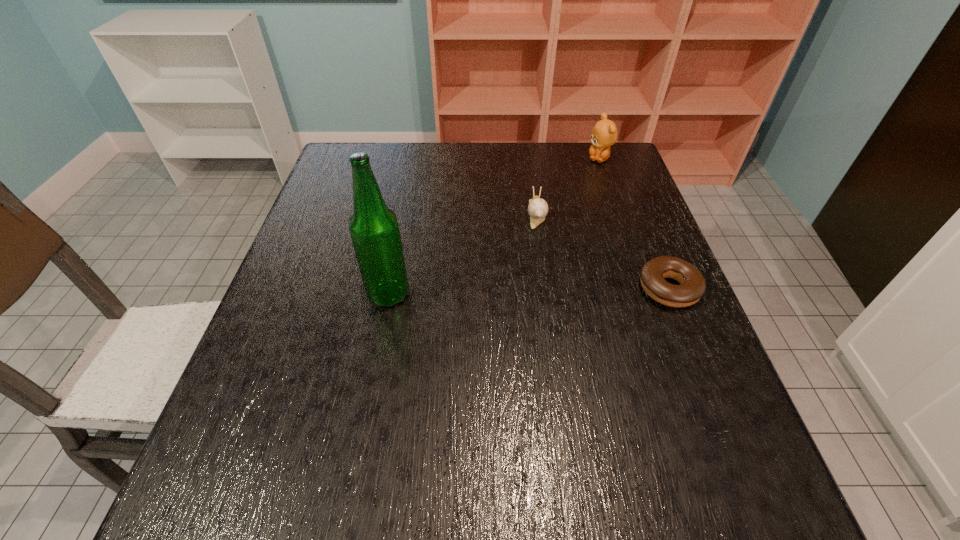
Where is `vacant space positioned 0.330m on the left of the doughnut`? The height and width of the screenshot is (540, 960). vacant space positioned 0.330m on the left of the doughnut is located at coordinates (492, 289).

Identify the location of free space located 0.150m on the shell of the escargot. (541, 271).

The image size is (960, 540). Find the location of `vacant point located 0.400m on the shell of the escargot`. vacant point located 0.400m on the shell of the escargot is located at coordinates (549, 361).

This screenshot has height=540, width=960. In order to click on vacant space situated on the shell of the escargot in this screenshot , I will do `click(541, 271)`.

Find the location of a particular element. vacant space located 0.140m on the face of the teddy bear is located at coordinates (577, 188).

This screenshot has height=540, width=960. In order to click on free region located on the face of the teddy bear in this screenshot , I will do `click(587, 177)`.

Find the location of a particular element. free space located on the face of the teddy bear is located at coordinates (559, 212).

I want to click on object that is at the far edge, so click(x=604, y=134).

Image resolution: width=960 pixels, height=540 pixels. I want to click on doughnut situated at the right edge, so click(x=693, y=286).

This screenshot has height=540, width=960. Identify the location of teddy bear positioned at the right edge. (604, 134).